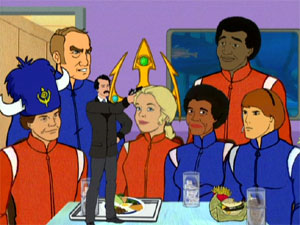
The image size is (300, 225). Find the location of `food tray`. food tray is located at coordinates (152, 216).